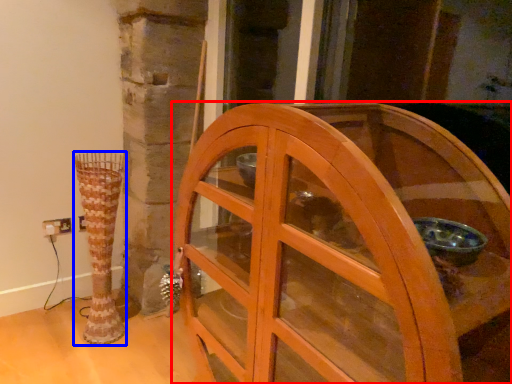
Question: Which object is closer to the camera taking this photo, furniture (highlighted by a red box) or vase (highlighted by a blue box)?

Choices:
 (A) furniture
 (B) vase

Answer: (A)